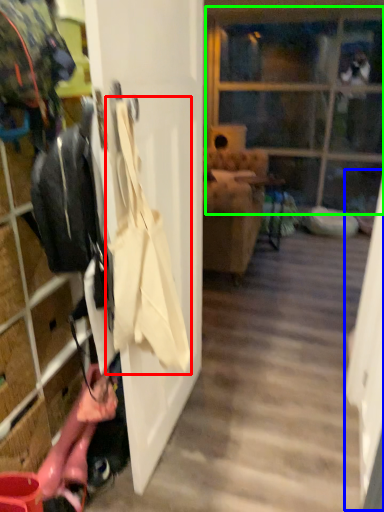
Question: Which is farther away from shoulder bag (highlighted by a red box)? screen door (highlighted by a blue box) or glass door (highlighted by a green box)?

Choices:
 (A) screen door
 (B) glass door

Answer: (B)